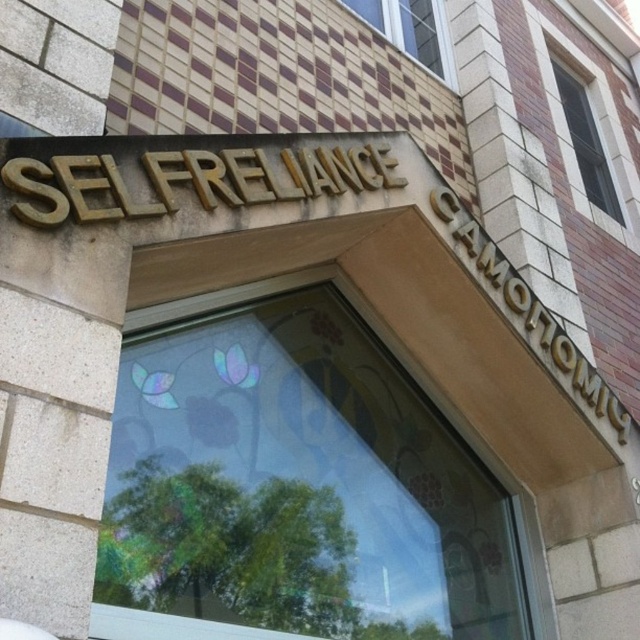
Question: Where is clear glass window at upper center located in relation to clear glass window at upper right in the image?

Choices:
 (A) below
 (B) above

Answer: (B)

Question: Which point is farther from the camera taking this photo?

Choices:
 (A) (257, 396)
 (B) (438, 49)
 (C) (596, 186)

Answer: (C)

Question: Is transparent stained glass at center to the left of clear glass window at upper center from the viewer's perspective?

Choices:
 (A) no
 (B) yes

Answer: (B)

Question: Is transparent stained glass at center below clear glass window at upper right?

Choices:
 (A) yes
 (B) no

Answer: (A)

Question: Which point is closer to the camera?

Choices:
 (A) clear glass window at upper right
 (B) transparent stained glass at center

Answer: (B)

Question: Which of the following is the farthest from the observer?

Choices:
 (A) clear glass window at upper right
 (B) transparent stained glass at center
 (C) clear glass window at upper center

Answer: (A)